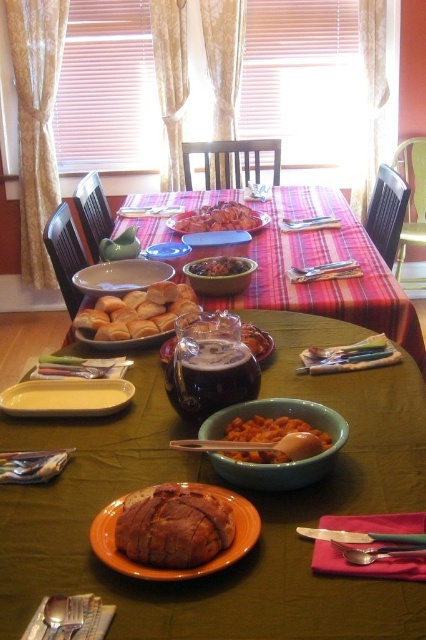
You are standing at the dining table and want to reach both points on the table. Which point, point (81, 564) or point (224, 269), is closer to you?

Point (81, 564) is closer to the viewer than point (224, 269).

You are standing at the dining table and want to reach both points on the table. Which point, point [46,592] or point [293,429], will you reach first?

Point [46,592] is closer to the viewer than point [293,429], so you will reach point [46,592] first.

You are arranging a breakfast spread on the dining table. You have a green matte bowl at center and an orange glazed bread at center. Which item is placed on top of the other?

The green matte bowl at center is positioned over orange glazed bread at center, so the bowl is placed on top of the bread.